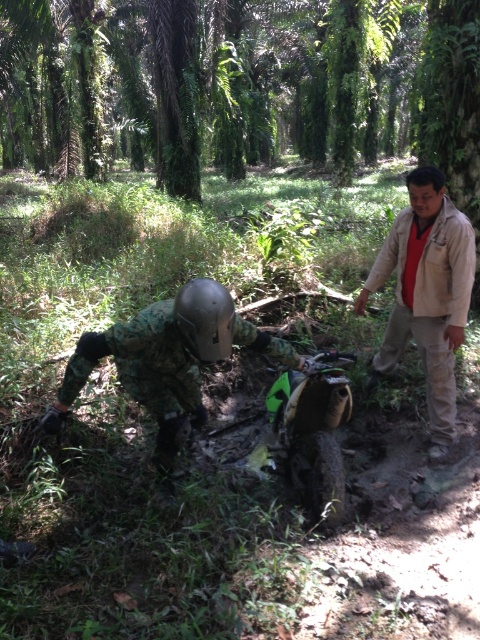
You are navigating through the jungle and need to reach a point located at coordinates point (156, 444). You are currently at point (229, 342). Based on the scene description, can you determine if you are behind or in front of your destination?

Point (156, 444) is behind point (229, 342), so you are currently in front of your destination.

Looking at this image, you are a photographer trying to capture a clear shot of the metallic gray helmet at center and the beige cotton shirt at upper right. Since you want both items to appear the same size in your photo, which object should you move closer to the camera and by how much?

The beige cotton shirt at upper right is currently larger than the metallic gray helmet at center. To make them appear the same size in the photo, you should move the metallic gray helmet at center closer to the camera by an amount that reduces its apparent size to match the smaller size of the beige cotton shirt at upper right.